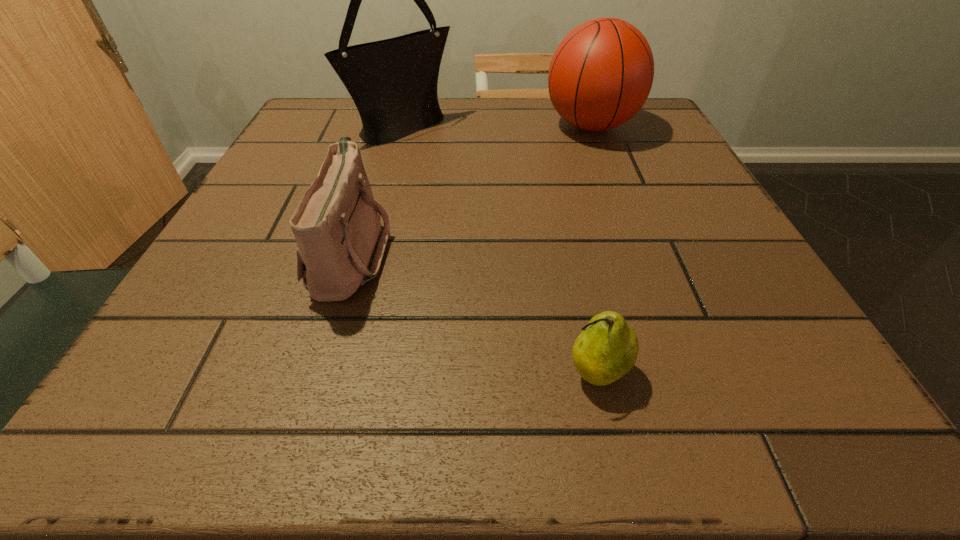
Where is `blank space at the right edge of the desktop`? This screenshot has height=540, width=960. blank space at the right edge of the desktop is located at coordinates (680, 217).

What are the coordinates of `vacant space at the far right corner` in the screenshot? It's located at (633, 143).

Locate an element on the screen. The height and width of the screenshot is (540, 960). empty space between the nearer shoulder bag and the farther shoulder bag is located at coordinates (377, 190).

At what (x,y) coordinates should I click in order to perform the action: click on vacant area that lies between the second nearest object and the nearest object. Please return your answer as a coordinate pair (x, y). This screenshot has width=960, height=540. Looking at the image, I should click on (474, 312).

You are a GUI agent. You are given a task and a screenshot of the screen. Output one action in this format:
    pyautogui.click(x=<x>, y=<y>)
    Task: Click on the free space between the second tallest object and the third tallest object
    The height and width of the screenshot is (540, 960).
    Given the screenshot: What is the action you would take?
    pyautogui.click(x=470, y=189)

Find the location of a particular element. The height and width of the screenshot is (540, 960). vacant space in between the pear and the farther shoulder bag is located at coordinates (500, 250).

Locate an element on the screen. free space between the second shortest object and the tallest object is located at coordinates (377, 190).

This screenshot has width=960, height=540. Identify the location of free space that is in between the second tallest object and the third farthest object. (470, 189).

In order to click on vacant region between the basketball and the pear in this screenshot , I will do `click(594, 249)`.

Locate an element on the screen. empty space between the pear and the farther shoulder bag is located at coordinates (500, 250).